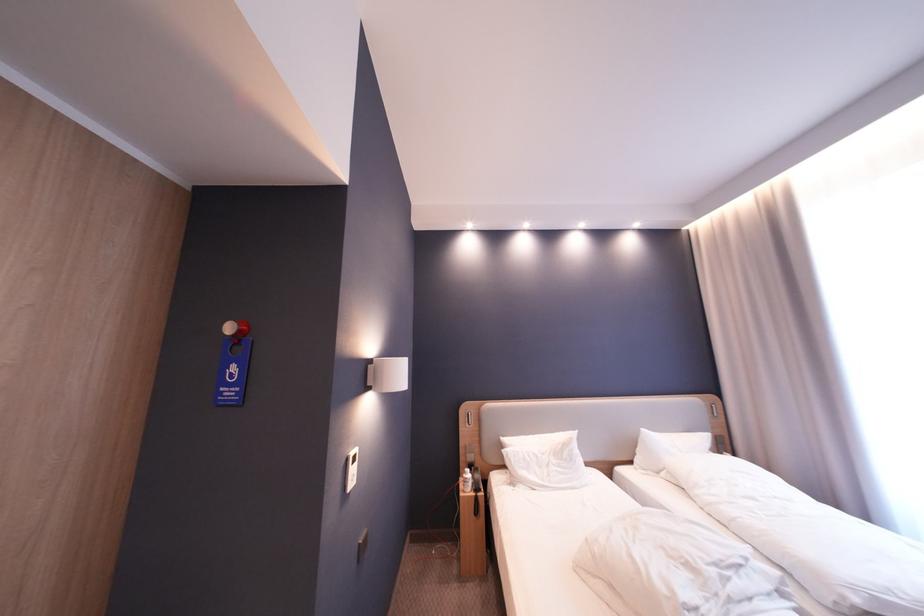
Describe the element at coordinates (467, 480) in the screenshot. The width and height of the screenshot is (924, 616). I see `a white bottle pump` at that location.